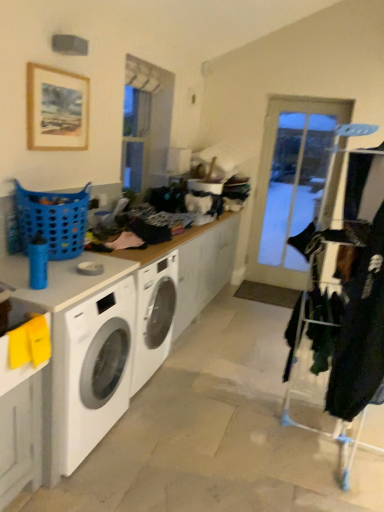
Question: Is metal/textured clothes rack at right not close to velvet black coat at right?

Choices:
 (A) no
 (B) yes

Answer: (A)

Question: Is metal/textured clothes rack at right at the right side of velvet black coat at right?

Choices:
 (A) yes
 (B) no

Answer: (A)

Question: Is metal/textured clothes rack at right smaller than velvet black coat at right?

Choices:
 (A) yes
 (B) no

Answer: (B)

Question: Considering the relative positions of metal/textured clothes rack at right and velvet black coat at right in the image provided, is metal/textured clothes rack at right to the left of velvet black coat at right from the viewer's perspective?

Choices:
 (A) no
 (B) yes

Answer: (A)

Question: From the image's perspective, would you say metal/textured clothes rack at right is positioned over velvet black coat at right?

Choices:
 (A) no
 (B) yes

Answer: (B)

Question: Is velvet black coat at right completely or partially inside metal/textured clothes rack at right?

Choices:
 (A) no
 (B) yes

Answer: (B)

Question: Considering the relative sizes of yellow matte sink at lower left and wooden picture frame at upper left in the image provided, is yellow matte sink at lower left shorter than wooden picture frame at upper left?

Choices:
 (A) no
 (B) yes

Answer: (B)

Question: From a real-world perspective, is yellow matte sink at lower left on top of wooden picture frame at upper left?

Choices:
 (A) yes
 (B) no

Answer: (B)

Question: Is yellow matte sink at lower left surrounding wooden picture frame at upper left?

Choices:
 (A) no
 (B) yes

Answer: (A)

Question: Is yellow matte sink at lower left next to wooden picture frame at upper left?

Choices:
 (A) yes
 (B) no

Answer: (B)

Question: Is yellow matte sink at lower left looking in the opposite direction of wooden picture frame at upper left?

Choices:
 (A) no
 (B) yes

Answer: (A)

Question: Is yellow matte sink at lower left facing towards wooden picture frame at upper left?

Choices:
 (A) no
 (B) yes

Answer: (A)

Question: Is blue plastic laundry basket at left oriented towards wooden picture frame at upper left?

Choices:
 (A) no
 (B) yes

Answer: (A)